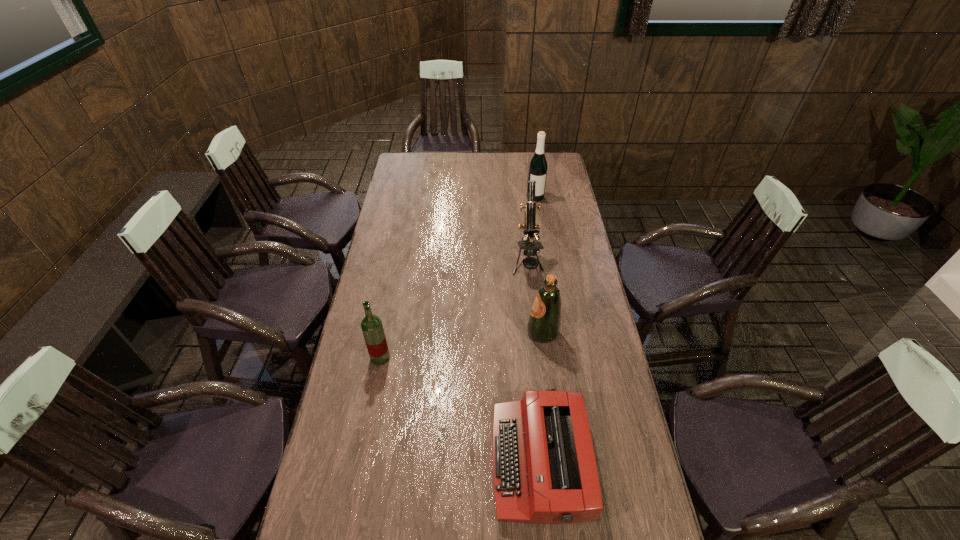
The image size is (960, 540). I want to click on microscope, so click(x=532, y=247).

What are the coordinates of `the farthest object` in the screenshot? It's located at (538, 167).

Identify the location of olive oil. (544, 322).

The height and width of the screenshot is (540, 960). What are the coordinates of `the second nearest object` in the screenshot? It's located at (371, 325).

Where is `the leftmost object`? Image resolution: width=960 pixels, height=540 pixels. the leftmost object is located at coordinates (371, 325).

This screenshot has height=540, width=960. Find the location of `the shortest object`. the shortest object is located at coordinates coord(544,469).

Image resolution: width=960 pixels, height=540 pixels. I want to click on typewriter, so click(x=544, y=469).

The width and height of the screenshot is (960, 540). I want to click on vacant space located through the eyepiece of the second farthest object, so click(x=539, y=363).

Image resolution: width=960 pixels, height=540 pixels. What are the coordinates of `free space located on the label of the wine bottle` in the screenshot? It's located at (540, 228).

Find the location of `free space located 0.170m on the front-facing side of the olive oil`. free space located 0.170m on the front-facing side of the olive oil is located at coordinates (480, 333).